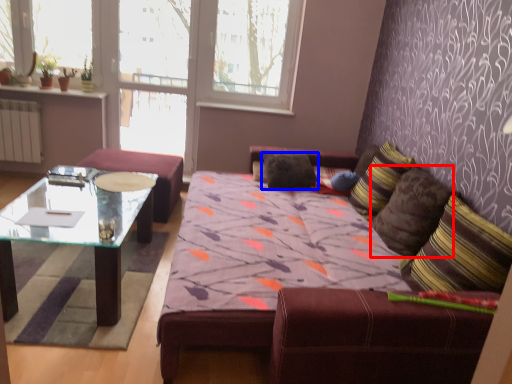
Question: Which object is closer to the camera taking this photo, pillow (highlighted by a red box) or pillow (highlighted by a blue box)?

Choices:
 (A) pillow
 (B) pillow

Answer: (A)